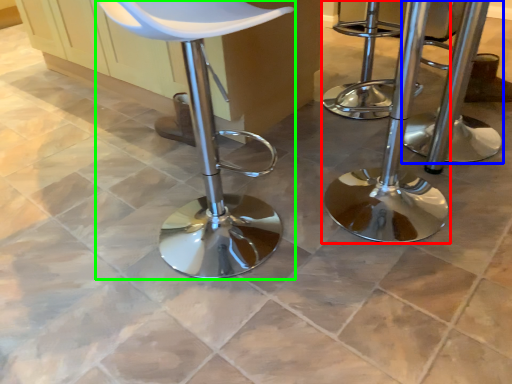
Question: Based on their relative distances, which object is nearer to stool (highlighted by a red box)? Choose from stool (highlighted by a blue box) and chair (highlighted by a green box).

Choices:
 (A) stool
 (B) chair

Answer: (A)